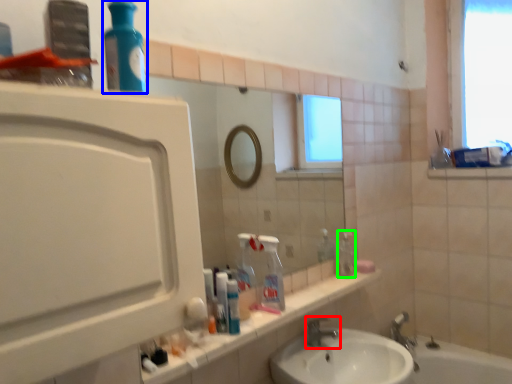
Question: Based on their relative distances, which object is nearer to tap (highlighted by a red box)? Choose from cleaning product (highlighted by a blue box) and bottle (highlighted by a green box).

Choices:
 (A) cleaning product
 (B) bottle

Answer: (B)